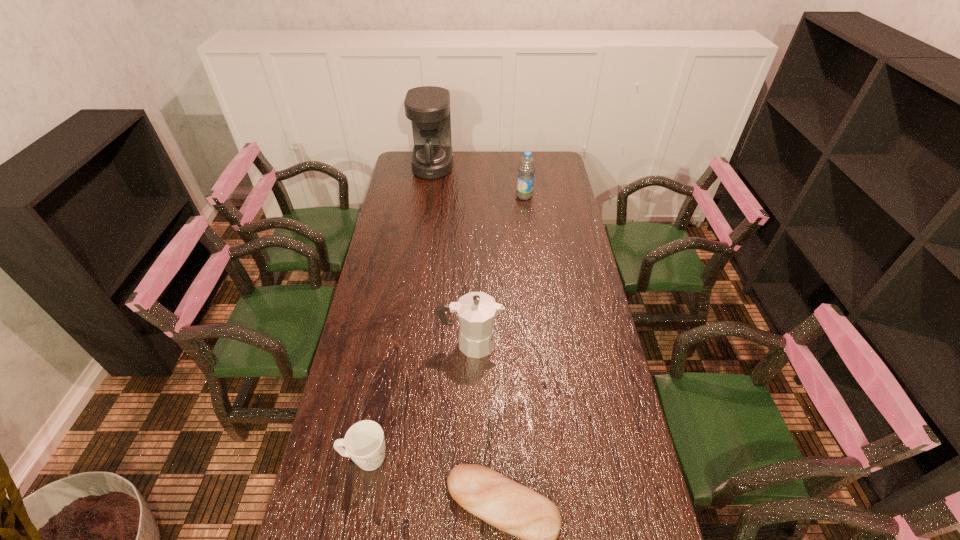
What are the coordinates of `free space that is in between the coffee maker and the coffeepot` in the screenshot? It's located at click(452, 254).

The image size is (960, 540). I want to click on free space that is in between the water bottle and the fourth tallest object, so click(444, 327).

You are a GUI agent. You are given a task and a screenshot of the screen. Output one action in this format:
    pyautogui.click(x=<x>, y=<y>)
    Task: Click on the free area in between the farthest object and the second farthest object
    The height and width of the screenshot is (540, 960).
    Given the screenshot: What is the action you would take?
    pyautogui.click(x=479, y=181)

Find the location of `the fourth closest object to the coffee maker`. the fourth closest object to the coffee maker is located at coordinates (511, 507).

In order to click on object that stands as the fourth closest to the coffee maker in this screenshot , I will do `click(511, 507)`.

Image resolution: width=960 pixels, height=540 pixels. Identify the location of vacant region that satisfies the following two spatial constraints: 1. on the button side of the coffee maker; 2. on the back side of the water bottle. (429, 196).

At what (x,y) coordinates should I click in order to perform the action: click on vacant position in the image that satisfies the following two spatial constraints: 1. on the button side of the tallest object; 2. on the back side of the fourth nearest object. Please return your answer as a coordinate pair (x, y). The image size is (960, 540). Looking at the image, I should click on tap(429, 196).